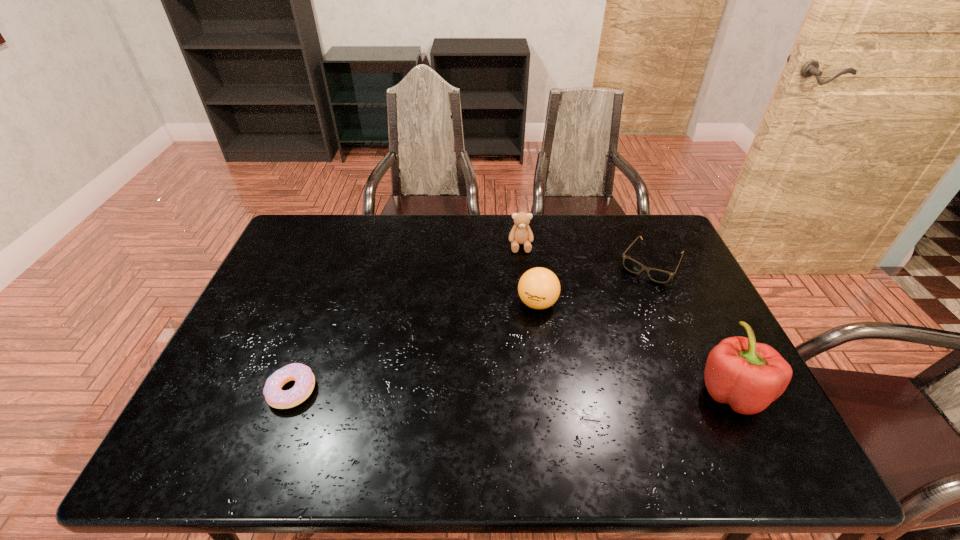
You are a GUI agent. You are given a task and a screenshot of the screen. Output one action in this format:
    pyautogui.click(x=<x>, y=<y>)
    Task: Click on the leftmost object
    The image size is (960, 540).
    Given the screenshot: What is the action you would take?
    pyautogui.click(x=304, y=379)

Identify the location of the tallest object. (749, 376).

You are a GUI agent. You are given a task and a screenshot of the screen. Output one action in this format:
    pyautogui.click(x=<x>, y=<y>)
    Task: Click on the sunglasses
    The image size is (960, 540).
    Given the screenshot: What is the action you would take?
    [661, 276]

You are a GUI agent. You are given a task and a screenshot of the screen. Output one action in this format:
    pyautogui.click(x=<x>, y=<y>)
    Task: Click on the teddy bear
    The image size is (960, 540).
    Given the screenshot: What is the action you would take?
    (x=521, y=233)

Where is `ping-pong ball`? This screenshot has width=960, height=540. ping-pong ball is located at coordinates (539, 288).

I want to click on free location located 0.180m on the right of the doughnut, so click(391, 390).

At what (x,y) coordinates should I click in order to perform the action: click on vacant space situated on the back of the tallest object. Please return your answer as a coordinate pair (x, y). Looking at the image, I should click on (669, 265).

Locate an element on the screen. vacant region located on the lenses of the sunglasses is located at coordinates (594, 354).

Image resolution: width=960 pixels, height=540 pixels. Find the location of `vacant space located on the lenses of the sunglasses`. vacant space located on the lenses of the sunglasses is located at coordinates 633,292.

Where is `free space located 0.320m on the lenses of the sunglasses`? This screenshot has width=960, height=540. free space located 0.320m on the lenses of the sunglasses is located at coordinates click(597, 349).